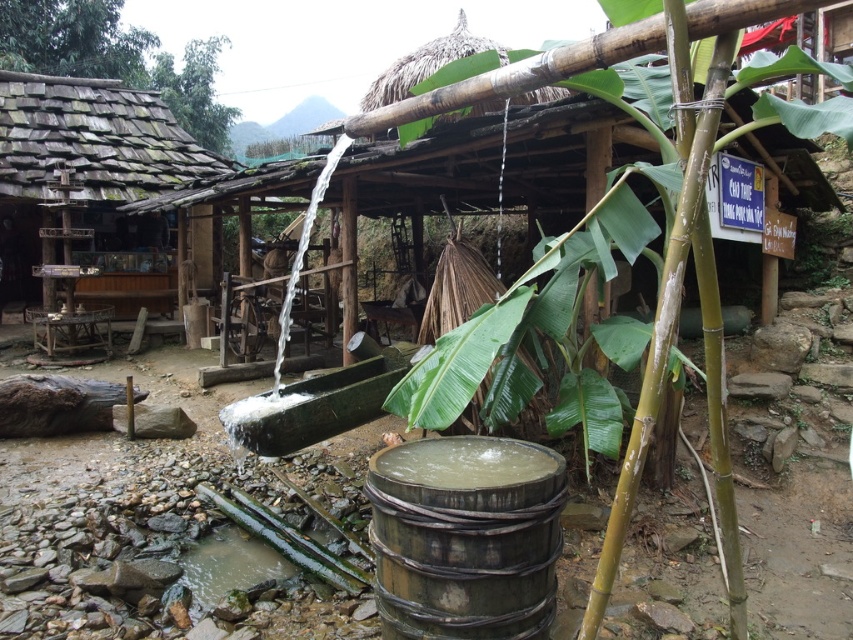
Does wooden barrel at center appear on the right side of green bamboo at center?

Incorrect, wooden barrel at center is not on the right side of green bamboo at center.

Can you confirm if wooden barrel at center is positioned to the left of green bamboo at center?

Yes, wooden barrel at center is to the left of green bamboo at center.

Find the location of a particular element. wooden barrel at center is located at coordinates (465, 538).

Is wooden barrel at center bigger than wooden shingles hut at left?

No.

Does wooden barrel at center have a lesser height compared to wooden shingles hut at left?

Indeed, wooden barrel at center has a lesser height compared to wooden shingles hut at left.

The height and width of the screenshot is (640, 853). Describe the element at coordinates (465, 538) in the screenshot. I see `wooden barrel at center` at that location.

Where is `wooden barrel at center`? This screenshot has width=853, height=640. wooden barrel at center is located at coordinates [x=465, y=538].

From the picture: Which is more to the right, green bamboo at center or wooden shingles hut at left?

Positioned to the right is green bamboo at center.

Does point (625, 474) come farther from viewer compared to point (10, 195)?

That is False.

You are a GUI agent. You are given a task and a screenshot of the screen. Output one action in this format:
    pyautogui.click(x=<x>, y=<y>)
    Task: Click on the green bamboo at center
    The width and height of the screenshot is (853, 640).
    Given the screenshot: What is the action you would take?
    pos(677,320)